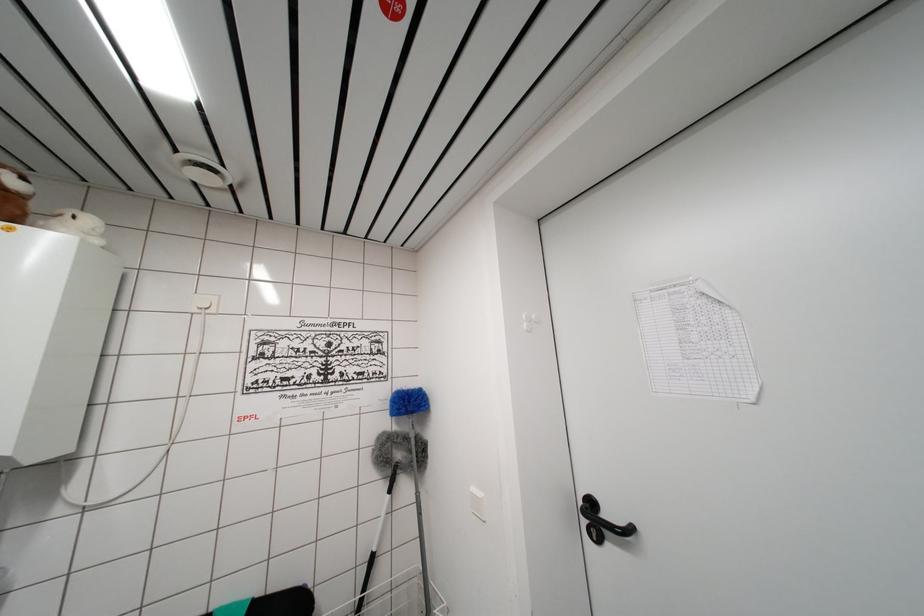
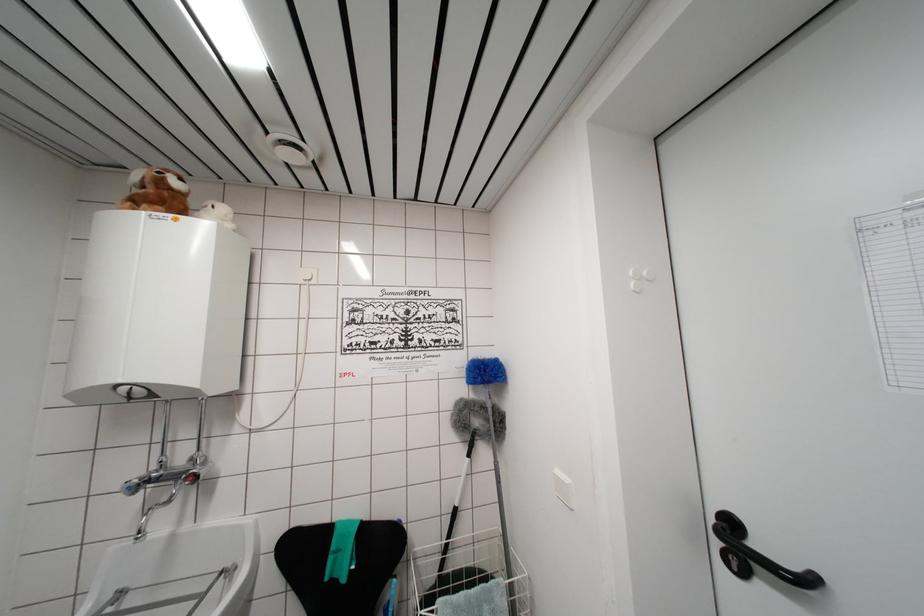
Find the pixel in the second image that matches (537,322) in the first image.

(649, 278)